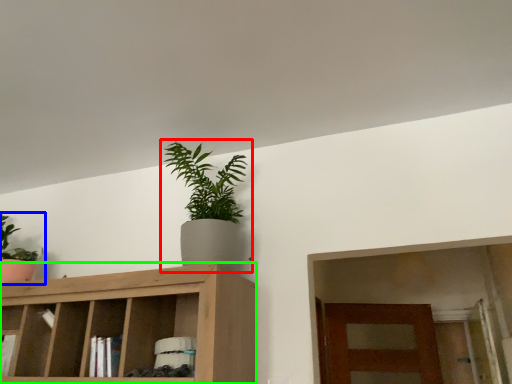
Question: Considering the real-world distances, which object is closest to houseplant (highlighted by a red box)? houseplant (highlighted by a blue box) or cabinetry (highlighted by a green box).

Choices:
 (A) houseplant
 (B) cabinetry

Answer: (B)